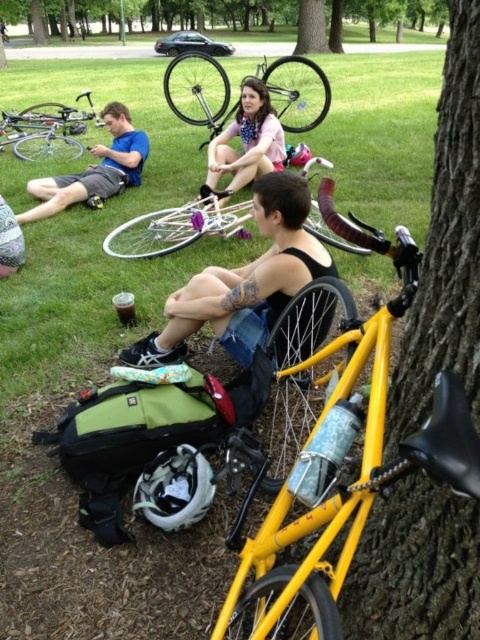
You are planning to take a photo of the yellow matte bicycle at center and the green textured tree at upper center. Which object should you focus on first if you want to capture both in the frame without moving the camera?

You should focus on the yellow matte bicycle at center first because it has a smaller width than the green textured tree at upper center, allowing more space to include both in the frame.

You are a photographer taking a picture of the matte blue shirt at left and the matte pink shirt at center. Which shirt should you adjust to ensure both are in focus? Explain your reasoning based on their positions.

The matte blue shirt at left is shorter than the matte pink shirt at center, so you should lower the camera angle to include both shirts in focus by adjusting the focus on the shorter matte blue shirt at left first.

You are a photographer trying to capture a group photo of the matte blue shirt at left and the matte pink shirt at center. Which person should you focus on first if you want to ensure their face is in focus, considering their size in the frame?

The matte blue shirt at left is bigger than the matte pink shirt at center, so you should focus on the matte blue shirt at left first since it occupies a larger portion of the frame and requires precise focus.